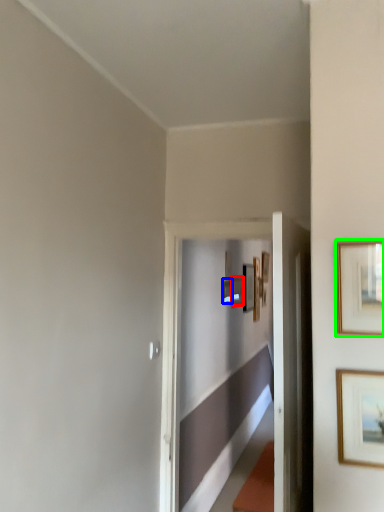
Question: Considering the real-world distances, which object is farthest from picture frame (highlighted by a red box)? picture frame (highlighted by a blue box) or picture frame (highlighted by a green box)?

Choices:
 (A) picture frame
 (B) picture frame

Answer: (B)